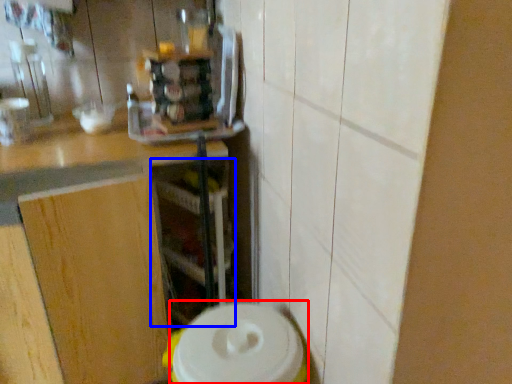
Question: Which point is closer to the camera, appliance (highlighted by a red box) or shelf (highlighted by a blue box)?

Choices:
 (A) appliance
 (B) shelf

Answer: (A)